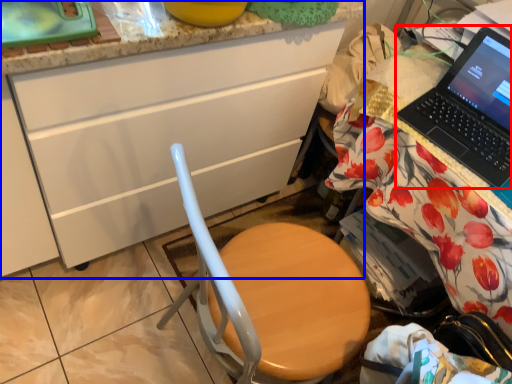
Question: Which object is further to the camera taking this photo, laptop (highlighted by a red box) or cabinetry (highlighted by a blue box)?

Choices:
 (A) laptop
 (B) cabinetry

Answer: (A)